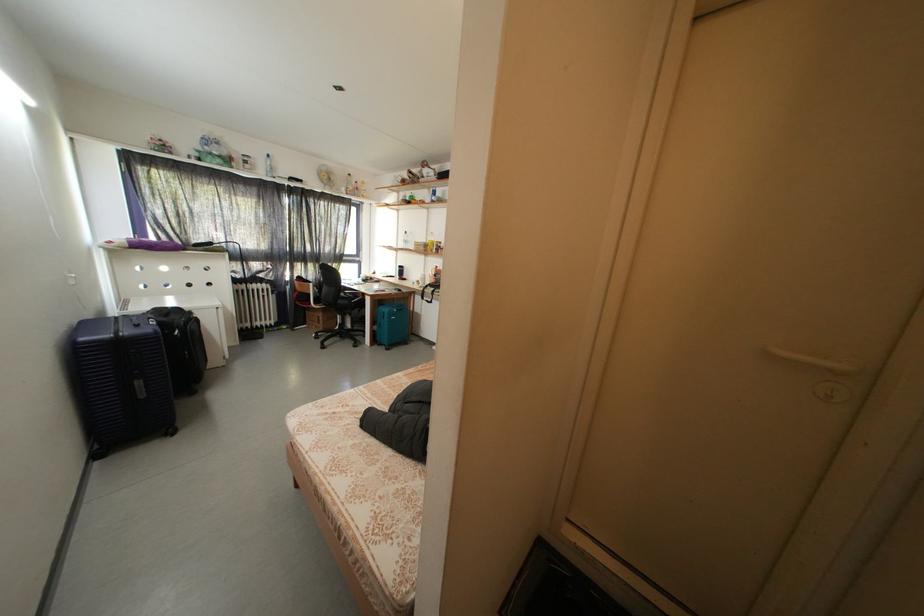
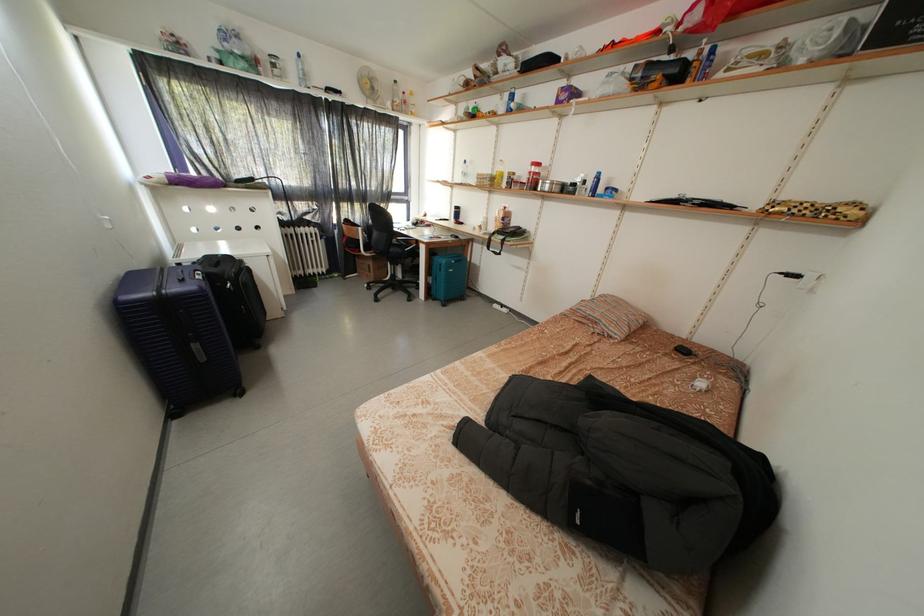
Question: Based on the continuous images, in which direction is the camera rotating? Reply with the corresponding letter.

Choices:
 (A) Left
 (B) Right
 (C) Up
 (D) Down

Answer: (D)